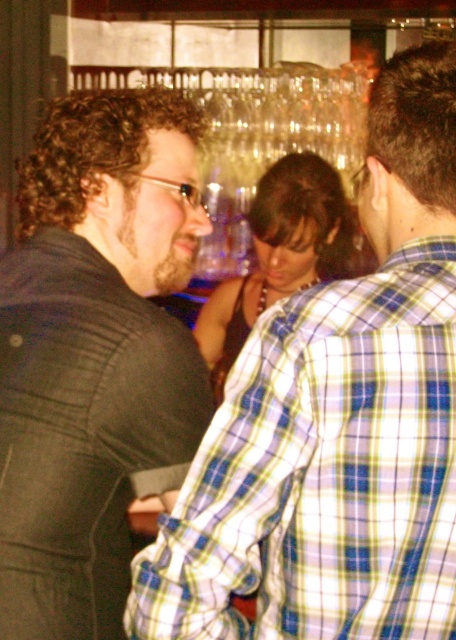
Where is `blue plaid shirt at center`? blue plaid shirt at center is located at coordinates (322, 472).

Can you confirm if blue plaid shirt at center is taller than matte black dress at center?

No, blue plaid shirt at center is not taller than matte black dress at center.

Which is in front, point (320, 317) or point (288, 294)?

Point (320, 317)

Where is `blue plaid shirt at center`? The width and height of the screenshot is (456, 640). blue plaid shirt at center is located at coordinates (322, 472).

Is point (233, 365) in front of point (73, 387)?

Yes, it is.

Between blue plaid shirt at center and dark gray suit at left, which one has less height?

blue plaid shirt at center is shorter.

Who is more distant from viewer, (x=436, y=344) or (x=73, y=476)?

Point (x=73, y=476)

The width and height of the screenshot is (456, 640). In order to click on blue plaid shirt at center in this screenshot , I will do `click(322, 472)`.

Describe the element at coordinates (93, 353) in the screenshot. Image resolution: width=456 pixels, height=640 pixels. I see `dark gray suit at left` at that location.

Does dark gray suit at left lie behind matte black dress at center?

No, it is in front of matte black dress at center.

Is point (67, 481) in front of point (347, 257)?

Yes.

The image size is (456, 640). In order to click on dark gray suit at left in this screenshot , I will do `click(93, 353)`.